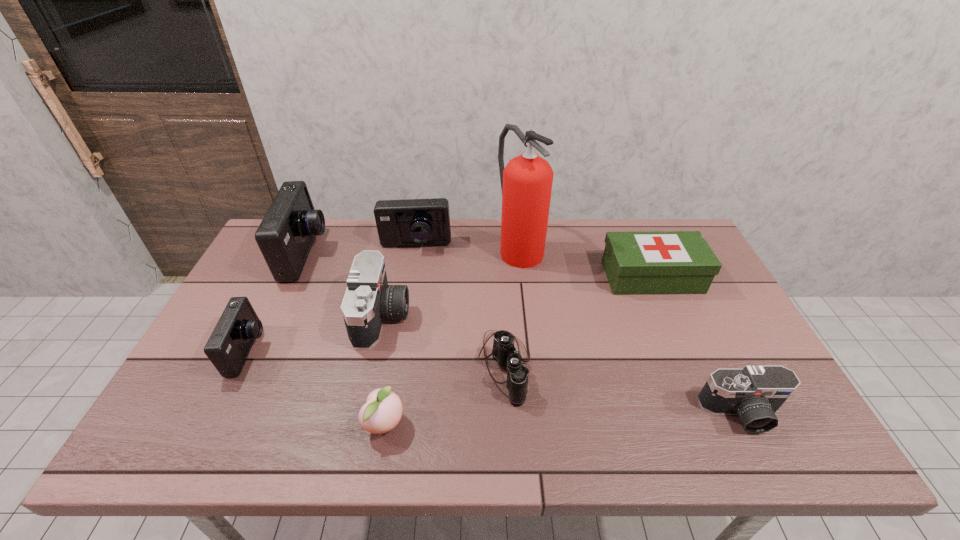
Locate an element on the screen. This screenshot has height=540, width=960. the rightmost camera is located at coordinates (754, 393).

Identify the location of the nearest camera. (754, 393).

Locate an element on the screen. pink peach is located at coordinates [382, 411].

Identify the location of free location located 0.330m on the handle side of the tallest object. The width and height of the screenshot is (960, 540). (532, 356).

At what (x,y) coordinates should I click in order to perform the action: click on free space located 0.290m on the front-facing side of the second tallest object. Please return your answer as a coordinate pair (x, y). The image size is (960, 540). Looking at the image, I should click on (414, 255).

Locate an element on the screen. vacant space positioned 0.200m on the front-facing side of the second smallest blue camera is located at coordinates (406, 298).

At what (x,y) coordinates should I click in order to perform the action: click on free point located on the front-facing side of the left black camera. Please return your answer as a coordinate pair (x, y). Image resolution: width=960 pixels, height=540 pixels. Looking at the image, I should click on (533, 316).

You are a GUI agent. You are given a task and a screenshot of the screen. Output one action in this format:
    pyautogui.click(x=<x>, y=<y>)
    Task: Click on the blank space located on the front-facing side of the smallest blue camera
    
    Given the screenshot: What is the action you would take?
    pyautogui.click(x=351, y=351)

Where is `blank area located on the left of the first-aid kit`? The width and height of the screenshot is (960, 540). blank area located on the left of the first-aid kit is located at coordinates (521, 277).

This screenshot has height=540, width=960. Identify the location of free location located 0.060m on the front of the binoculars. (508, 431).